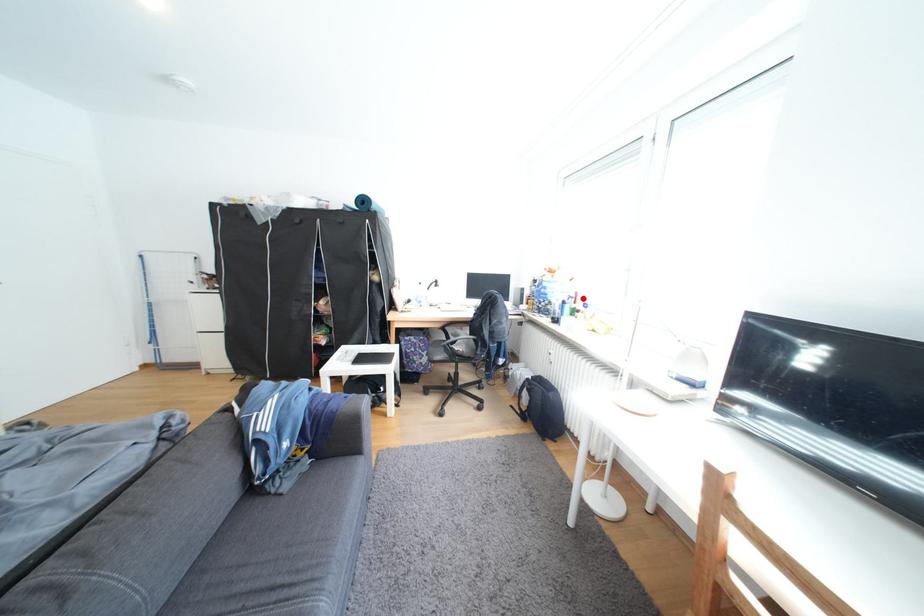
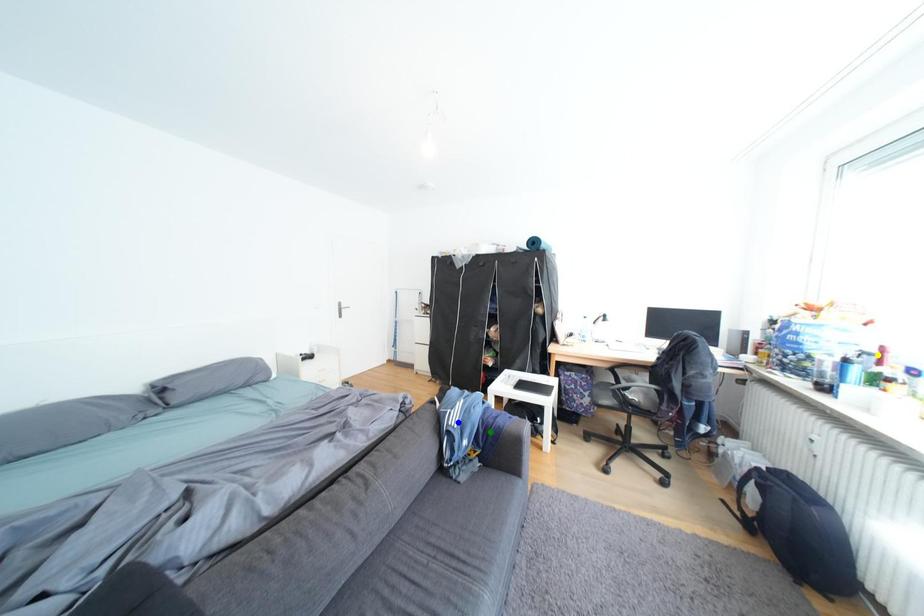
Question: I am providing you with two images of the same scene from different viewpoints. A red point is marked on the first image. You are given multiple points on the second image. In image 2, which mark is for the same physical point as the one in image 1?

Choices:
 (A) blue point
 (B) green point
 (C) yellow point

Answer: (C)